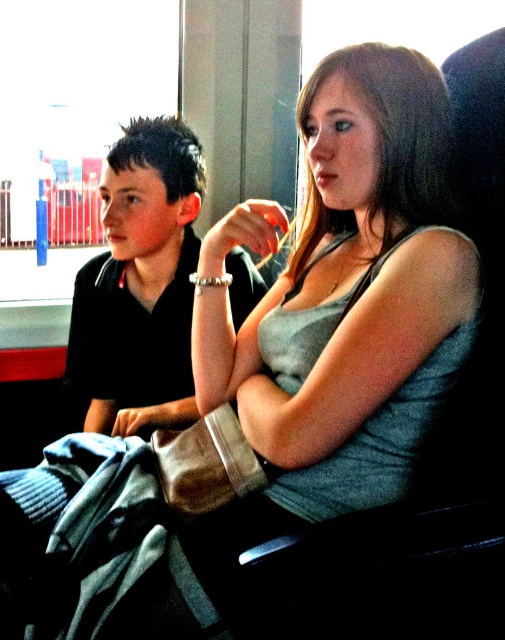
Between gray cotton tank top at center and black matte shirt at left, which one has more height?

Standing taller between the two is gray cotton tank top at center.

Is point (460, 262) positioned after point (152, 324)?

No.

At what (x,y) coordinates should I click in order to perform the action: click on gray cotton tank top at center. Please return your answer as a coordinate pair (x, y). The height and width of the screenshot is (640, 505). Looking at the image, I should click on (346, 291).

At what (x,y) coordinates should I click in order to perform the action: click on gray cotton tank top at center. Please return your answer as a coordinate pair (x, y). Image resolution: width=505 pixels, height=640 pixels. Looking at the image, I should click on click(346, 291).